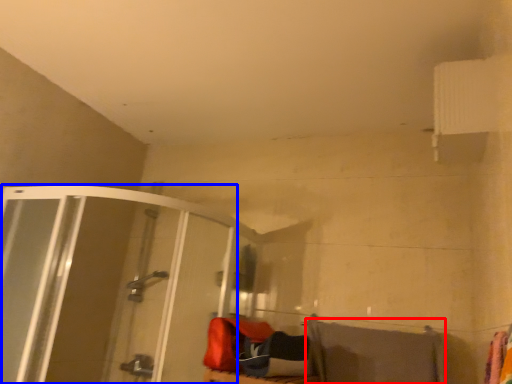
Question: Among these objects, which one is nearest to the camera, beach towel (highlighted by a red box) or shower door (highlighted by a blue box)?

Choices:
 (A) beach towel
 (B) shower door

Answer: (B)